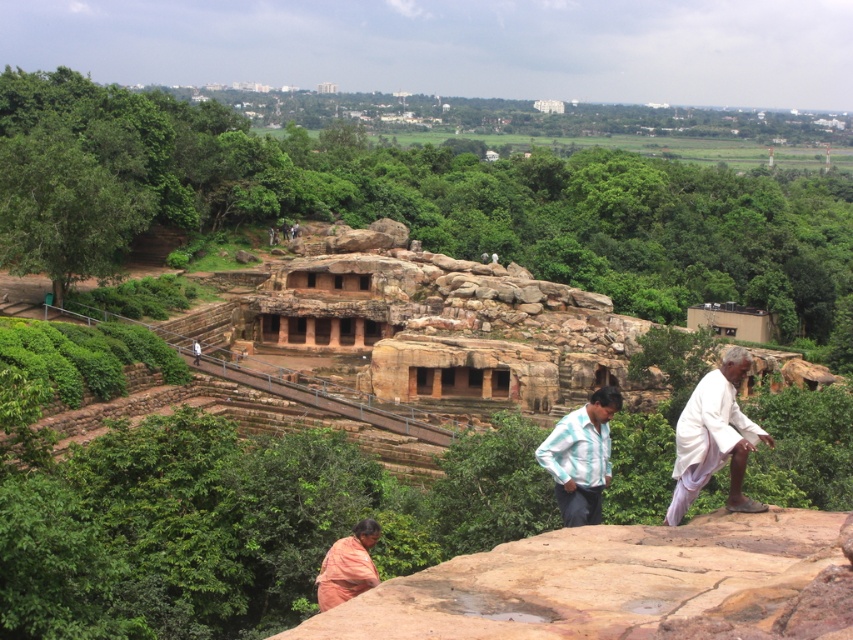
Between white cotton shirt at right and orange cotton sari at lower center, which one has more height?

With more height is white cotton shirt at right.

The height and width of the screenshot is (640, 853). What do you see at coordinates (714, 436) in the screenshot? I see `white cotton shirt at right` at bounding box center [714, 436].

Which is behind, point (732, 460) or point (357, 557)?

The point (732, 460) is behind.

At what (x,y) coordinates should I click in order to perform the action: click on white cotton shirt at right. Please return your answer as a coordinate pair (x, y). The height and width of the screenshot is (640, 853). Looking at the image, I should click on (714, 436).

Between striped cotton shirt at center and orange cotton sari at lower center, which one appears on the left side from the viewer's perspective?

orange cotton sari at lower center is more to the left.

Which is in front, point (585, 413) or point (360, 573)?

Point (360, 573)

Is point (579, 440) behind point (370, 541)?

Yes, it is.

Identify the location of striped cotton shirt at center. (581, 458).

Consider the image. Between white cotton shirt at right and striped cotton shirt at center, which one has more height?

Standing taller between the two is white cotton shirt at right.

Is point (721, 388) closer to viewer compared to point (602, 484)?

Yes.

The image size is (853, 640). I want to click on white cotton shirt at right, so click(714, 436).